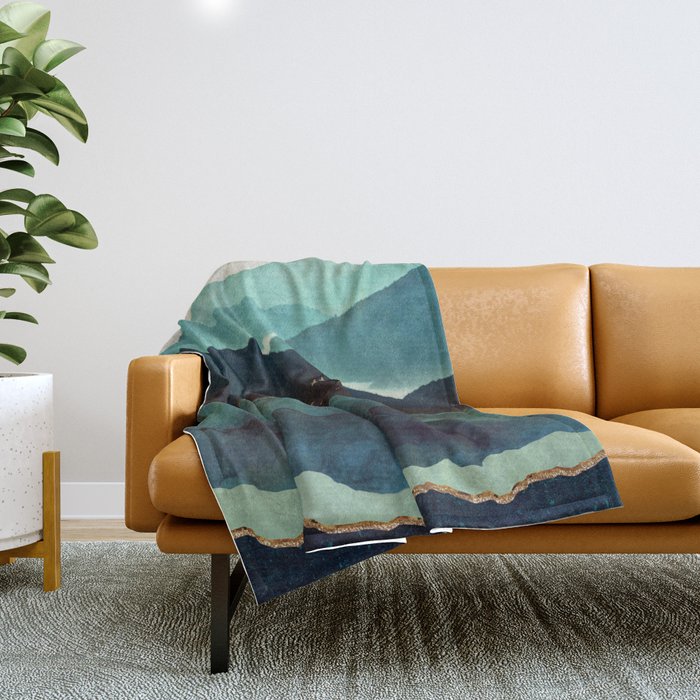
The height and width of the screenshot is (700, 700). I want to click on vase, so click(24, 419).